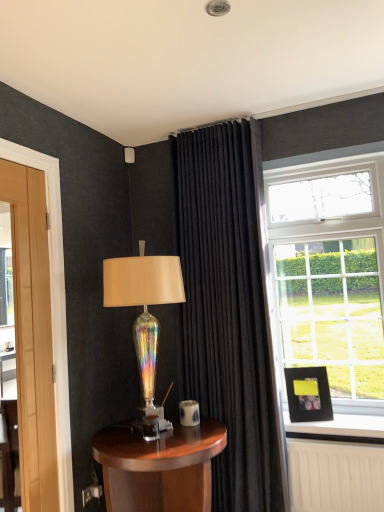
Question: From a real-world perspective, is black velvet curtain at center on top of wooden table at lower center?

Choices:
 (A) no
 (B) yes

Answer: (B)

Question: Is black velvet curtain at center at the right side of wooden table at lower center?

Choices:
 (A) no
 (B) yes

Answer: (B)

Question: Can you confirm if black velvet curtain at center is bigger than wooden table at lower center?

Choices:
 (A) no
 (B) yes

Answer: (B)

Question: Is black velvet curtain at center closer to camera compared to wooden table at lower center?

Choices:
 (A) no
 (B) yes

Answer: (A)

Question: Does black velvet curtain at center have a greater width compared to wooden table at lower center?

Choices:
 (A) no
 (B) yes

Answer: (A)

Question: Considering the relative sizes of black velvet curtain at center and wooden table at lower center in the image provided, is black velvet curtain at center thinner than wooden table at lower center?

Choices:
 (A) no
 (B) yes

Answer: (B)

Question: Is black matte picture frame at right facing towards iridescent glass lamp at center?

Choices:
 (A) no
 (B) yes

Answer: (A)

Question: Can you confirm if black matte picture frame at right is bigger than iridescent glass lamp at center?

Choices:
 (A) no
 (B) yes

Answer: (A)

Question: Does black matte picture frame at right come in front of iridescent glass lamp at center?

Choices:
 (A) yes
 (B) no

Answer: (B)

Question: From the image's perspective, is black matte picture frame at right on iridescent glass lamp at center?

Choices:
 (A) yes
 (B) no

Answer: (B)

Question: From a real-world perspective, does black matte picture frame at right stand above iridescent glass lamp at center?

Choices:
 (A) no
 (B) yes

Answer: (A)

Question: Considering the relative positions of black matte picture frame at right and iridescent glass lamp at center in the image provided, is black matte picture frame at right to the left of iridescent glass lamp at center from the viewer's perspective?

Choices:
 (A) yes
 (B) no

Answer: (B)

Question: Is black velvet curtain at center surrounding iridescent glass lamp at center?

Choices:
 (A) no
 (B) yes

Answer: (A)